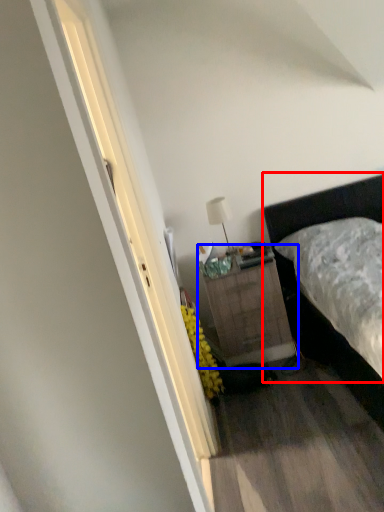
Question: Which object is further to the camera taking this photo, bed (highlighted by a red box) or nightstand (highlighted by a blue box)?

Choices:
 (A) bed
 (B) nightstand

Answer: (B)